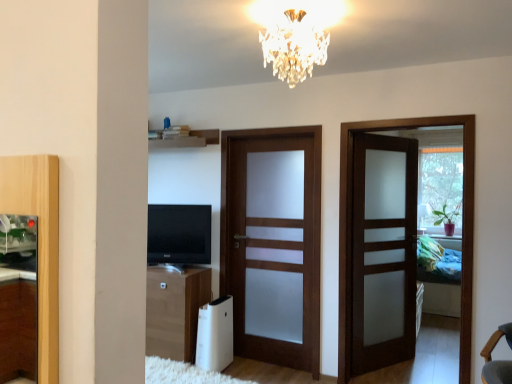
Question: From the image's perspective, is wooden shelf at upper center beneath black glossy tv at center?

Choices:
 (A) no
 (B) yes

Answer: (A)

Question: From the image's perspective, does wooden shelf at upper center appear higher than black glossy tv at center?

Choices:
 (A) no
 (B) yes

Answer: (B)

Question: Considering the relative sizes of wooden shelf at upper center and black glossy tv at center in the image provided, is wooden shelf at upper center shorter than black glossy tv at center?

Choices:
 (A) yes
 (B) no

Answer: (A)

Question: Is wooden shelf at upper center smaller than black glossy tv at center?

Choices:
 (A) yes
 (B) no

Answer: (A)

Question: Does wooden shelf at upper center appear on the left side of black glossy tv at center?

Choices:
 (A) no
 (B) yes

Answer: (B)

Question: From a real-world perspective, is black glossy tv at center positioned above or below satin wood door at right, marked as the 3th door in a left-to-right arrangement?

Choices:
 (A) below
 (B) above

Answer: (B)

Question: Is black glossy tv at center taller or shorter than satin wood door at right, which is the 1th door from right to left?

Choices:
 (A) tall
 (B) short

Answer: (B)

Question: From the image's perspective, is black glossy tv at center positioned above or below satin wood door at right, marked as the 3th door in a left-to-right arrangement?

Choices:
 (A) below
 (B) above

Answer: (B)

Question: Relative to satin wood door at right, which is the 1th door from right to left, is black glossy tv at center in front or behind?

Choices:
 (A) front
 (B) behind

Answer: (B)

Question: Visually, is white plastic air purifier at lower center positioned to the left or to the right of crystal glass chandelier at upper center?

Choices:
 (A) left
 (B) right

Answer: (A)

Question: Is white plastic air purifier at lower center taller or shorter than crystal glass chandelier at upper center?

Choices:
 (A) tall
 (B) short

Answer: (A)

Question: Is white plastic air purifier at lower center bigger or smaller than crystal glass chandelier at upper center?

Choices:
 (A) big
 (B) small

Answer: (A)

Question: From a real-world perspective, is white plastic air purifier at lower center positioned above or below crystal glass chandelier at upper center?

Choices:
 (A) above
 (B) below

Answer: (B)

Question: In terms of size, does brown matte door at center, the 2th door viewed from the right, appear bigger or smaller than black glossy tv at center?

Choices:
 (A) small
 (B) big

Answer: (B)

Question: Based on their positions, is brown matte door at center, placed as the second door when sorted from left to right, located to the left or right of black glossy tv at center?

Choices:
 (A) left
 (B) right

Answer: (B)